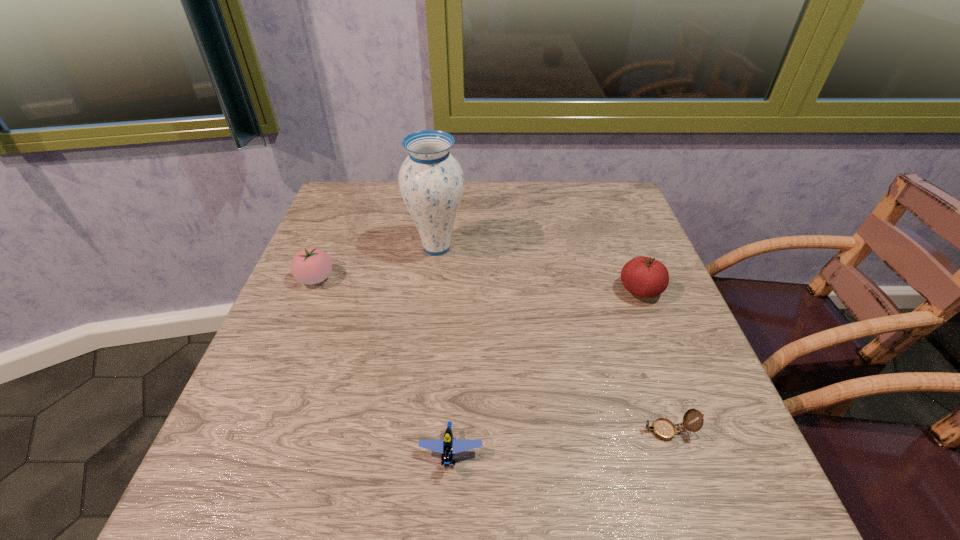
Locate an element on the screen. the tallest object is located at coordinates pos(431,181).

Image resolution: width=960 pixels, height=540 pixels. Identify the location of the right tomato. (642, 276).

Locate an element on the screen. This screenshot has width=960, height=540. the taller tomato is located at coordinates (642, 276).

Locate an element on the screen. the third shortest object is located at coordinates (311, 265).

At what (x,y) coordinates should I click in order to perform the action: click on the leftmost object. Please return your answer as a coordinate pair (x, y). This screenshot has height=540, width=960. Looking at the image, I should click on (311, 265).

You are a GUI agent. You are given a task and a screenshot of the screen. Output one action in this format:
    pyautogui.click(x=<x>, y=<y>)
    Task: Click on the Lego
    The image size is (960, 540).
    Given the screenshot: What is the action you would take?
    pyautogui.click(x=448, y=446)

In order to click on compass in this screenshot , I will do `click(664, 429)`.

Identify the location of free space located 0.320m on the front of the tallest object. This screenshot has width=960, height=540. (420, 383).

The image size is (960, 540). I want to click on vacant space located on the left of the right tomato, so click(x=435, y=291).

The width and height of the screenshot is (960, 540). What are the coordinates of `free region located on the right of the leftmost object` in the screenshot? It's located at (481, 278).